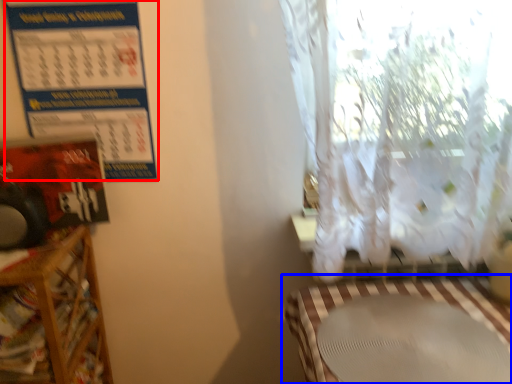
Question: Which object appears closest to the camera in this image, calendar (highlighted by a red box) or table (highlighted by a blue box)?

Choices:
 (A) calendar
 (B) table

Answer: (B)